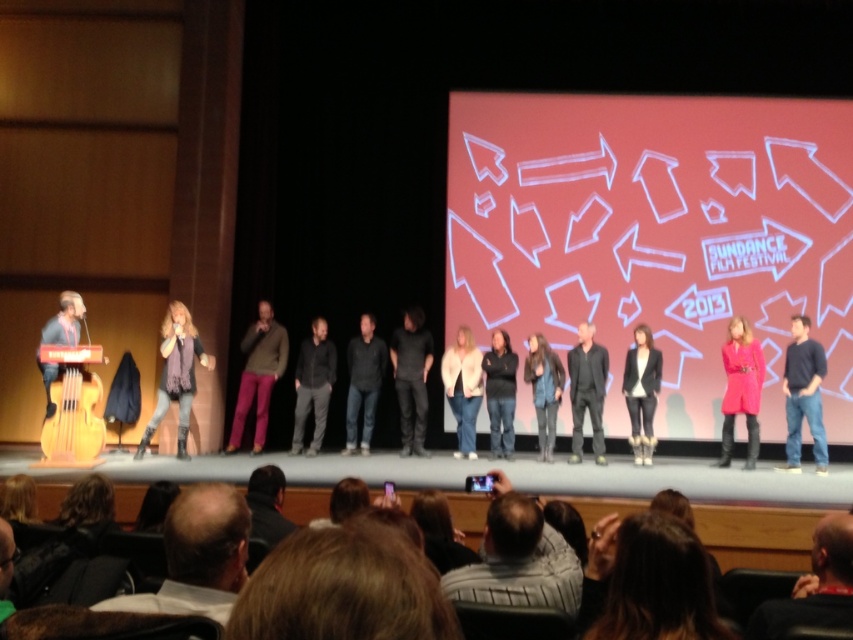
You are an event coordinator at the Sundance Film Festival. You need to ensure that the dark brown leather jacket at lower right and the black matte shirt at center are visible to the audience. Based on their positions, which one is placed higher on the stage?

The dark brown leather jacket at lower right is located above the black matte shirt at center, so it is placed higher on the stage.

You are a stagehand preparing to place a new backdrop behind the denim jeans at center and the black leather jacket at center during a scene change. Which object should you move first to ensure the backdrop can be positioned without obstruction?

The denim jeans at center is larger in size than the black leather jacket at center, so you should move the denim jeans at center first to accommodate its larger size and ensure the backdrop can be positioned without obstruction.